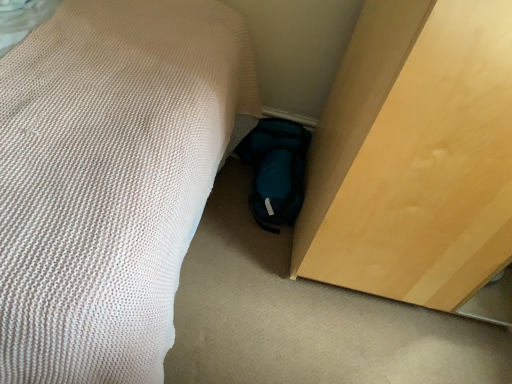
Question: Does teal fabric slipper at lower center have a lesser height compared to light wood cabinet at lower right?

Choices:
 (A) yes
 (B) no

Answer: (A)

Question: From a real-world perspective, does teal fabric slipper at lower center sit lower than light wood cabinet at lower right?

Choices:
 (A) yes
 (B) no

Answer: (A)

Question: Is teal fabric slipper at lower center to the right of light wood cabinet at lower right from the viewer's perspective?

Choices:
 (A) yes
 (B) no

Answer: (B)

Question: Are teal fabric slipper at lower center and light wood cabinet at lower right making contact?

Choices:
 (A) yes
 (B) no

Answer: (B)

Question: Does teal fabric slipper at lower center have a lesser width compared to light wood cabinet at lower right?

Choices:
 (A) no
 (B) yes

Answer: (B)

Question: Considering the relative positions of light wood cabinet at lower right and teal fabric slipper at lower center in the image provided, is light wood cabinet at lower right to the left or to the right of teal fabric slipper at lower center?

Choices:
 (A) right
 (B) left

Answer: (A)

Question: Considering the positions of light wood cabinet at lower right and teal fabric slipper at lower center in the image, is light wood cabinet at lower right taller or shorter than teal fabric slipper at lower center?

Choices:
 (A) tall
 (B) short

Answer: (A)

Question: Considering their positions, is light wood cabinet at lower right located in front of or behind teal fabric slipper at lower center?

Choices:
 (A) behind
 (B) front

Answer: (B)

Question: From the image's perspective, is light wood cabinet at lower right located above or below teal fabric slipper at lower center?

Choices:
 (A) above
 (B) below

Answer: (A)

Question: From a real-world perspective, is white textured bed at lower left positioned above or below light wood cabinet at lower right?

Choices:
 (A) above
 (B) below

Answer: (B)

Question: In terms of height, does white textured bed at lower left look taller or shorter compared to light wood cabinet at lower right?

Choices:
 (A) short
 (B) tall

Answer: (A)

Question: Considering the positions of point (169, 256) and point (329, 145), is point (169, 256) closer or farther from the camera than point (329, 145)?

Choices:
 (A) closer
 (B) farther

Answer: (A)

Question: Considering the positions of white textured bed at lower left and light wood cabinet at lower right in the image, is white textured bed at lower left wider or thinner than light wood cabinet at lower right?

Choices:
 (A) thin
 (B) wide

Answer: (B)

Question: Considering the relative positions of light wood cabinet at lower right and white textured bed at lower left in the image provided, is light wood cabinet at lower right to the left or to the right of white textured bed at lower left?

Choices:
 (A) right
 (B) left

Answer: (A)

Question: Considering the positions of light wood cabinet at lower right and white textured bed at lower left in the image, is light wood cabinet at lower right wider or thinner than white textured bed at lower left?

Choices:
 (A) wide
 (B) thin

Answer: (B)